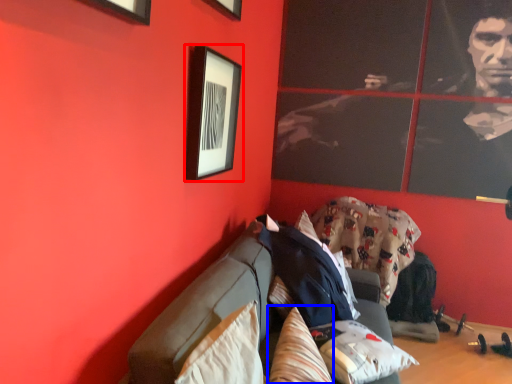
Question: Which point is closer to the camera, picture frame (highlighted by a red box) or pillow (highlighted by a blue box)?

Choices:
 (A) picture frame
 (B) pillow

Answer: (B)